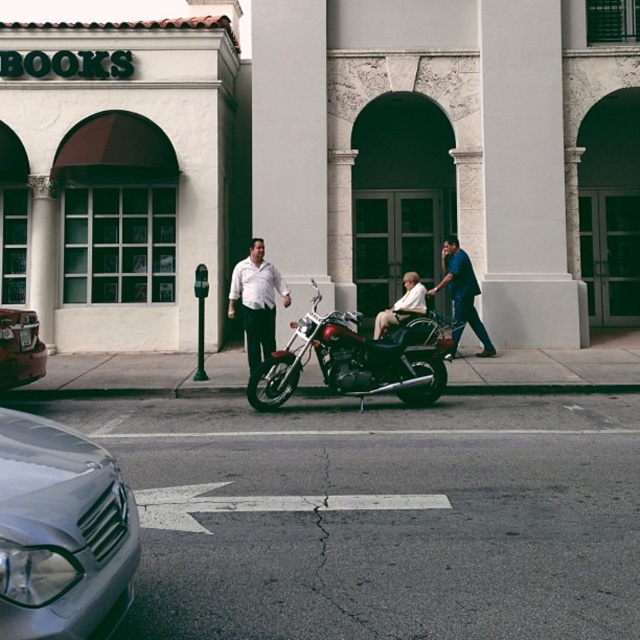
You are a delivery person who needs to park your van next to the silver metallic car at lower left and the shiny silver car at lower left. Which car should you park next to if you want to maximize the available space for your van?

The silver metallic car at lower left has a greater width than the shiny silver car at lower left. Therefore, you should park next to the shiny silver car at lower left to maximize the available space for your van.